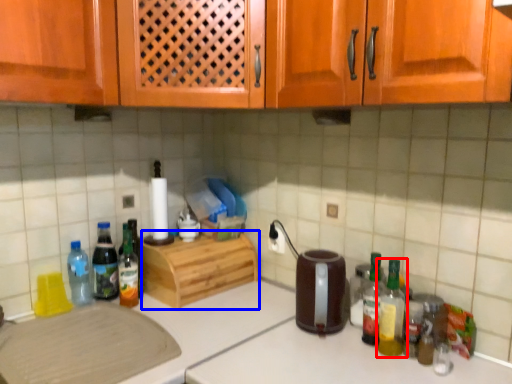
Question: Which of the following is the farthest to the observer, bottle (highlighted by a red box) or cabinetry (highlighted by a blue box)?

Choices:
 (A) bottle
 (B) cabinetry

Answer: (B)